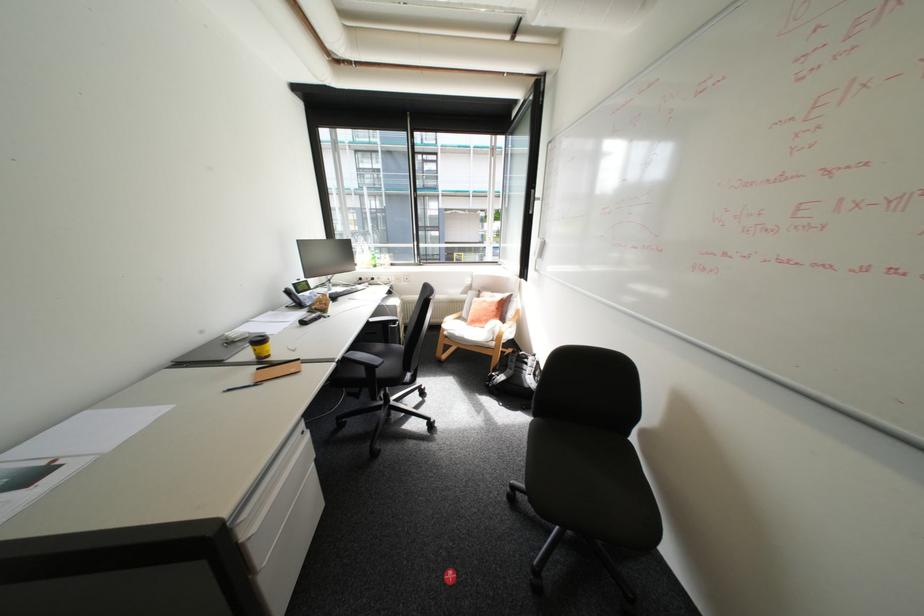
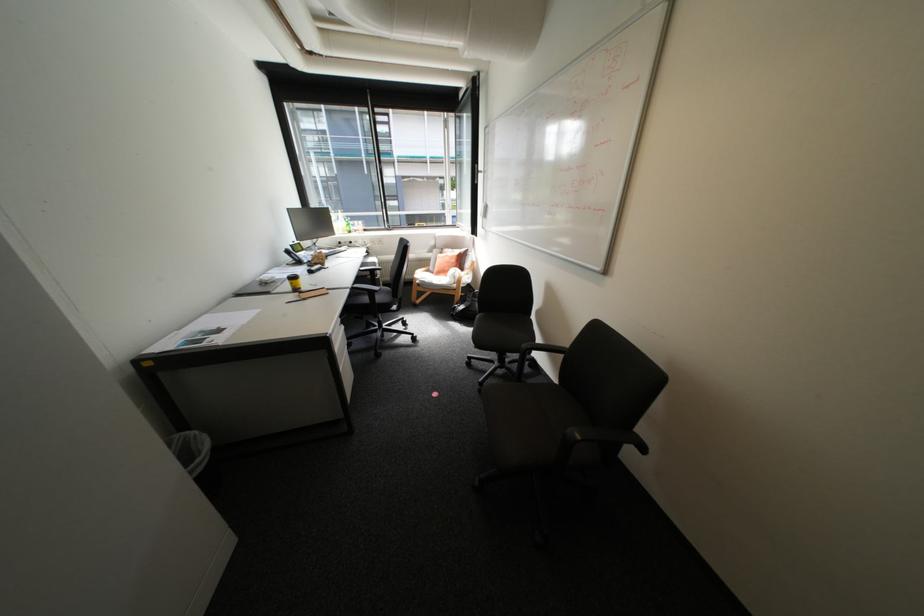
Where in the second image is the point corresponding to pixel 348 357 from the first image?

(359, 286)